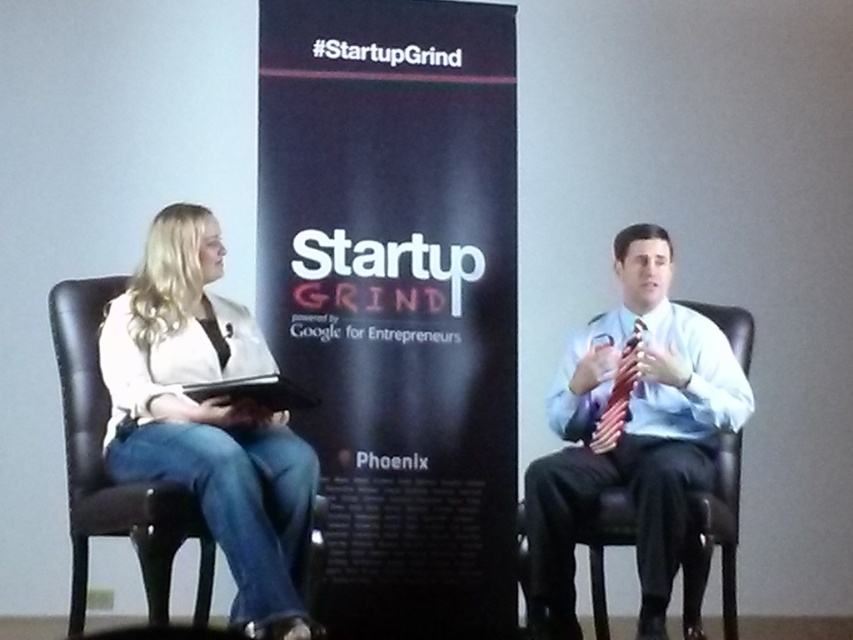
Question: Which of the following is the farthest from the observer?

Choices:
 (A) black paper at center
 (B) light blue shirt at center

Answer: (A)

Question: Which of the following is the closest to the observer?

Choices:
 (A) (660, 493)
 (B) (634, 376)
 (C) (186, 310)

Answer: (A)

Question: Does black paper at center have a lesser width compared to white matte jacket at left?

Choices:
 (A) yes
 (B) no

Answer: (B)

Question: Considering the real-world distances, which object is closest to the white matte jacket at left?

Choices:
 (A) light blue shirt at center
 (B) red satin tie at right
 (C) black paper at center

Answer: (C)

Question: Is white matte jacket at left in front of light blue shirt at center?

Choices:
 (A) yes
 (B) no

Answer: (A)

Question: Can you confirm if white matte jacket at left is bigger than light blue shirt at center?

Choices:
 (A) no
 (B) yes

Answer: (A)